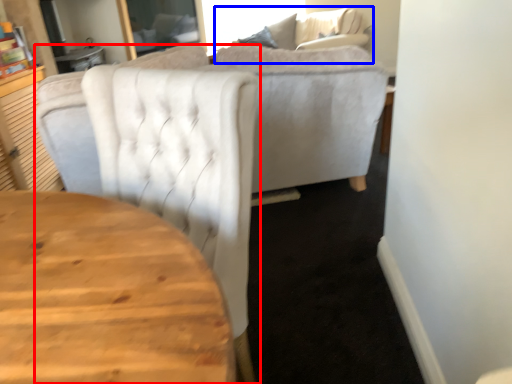
Question: Which object is closer to the camera taking this photo, chair (highlighted by a red box) or couch (highlighted by a blue box)?

Choices:
 (A) chair
 (B) couch

Answer: (A)